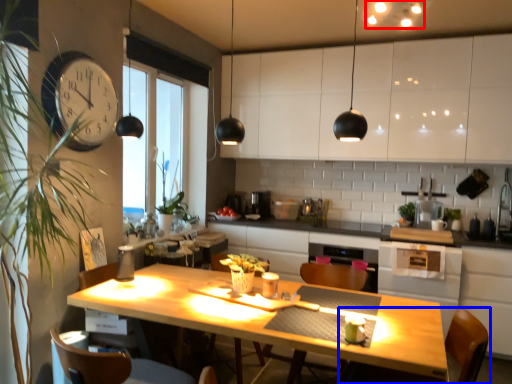
Question: Which of the following is the closest to the observer, lighting (highlighted by a red box) or chair (highlighted by a blue box)?

Choices:
 (A) lighting
 (B) chair

Answer: (B)